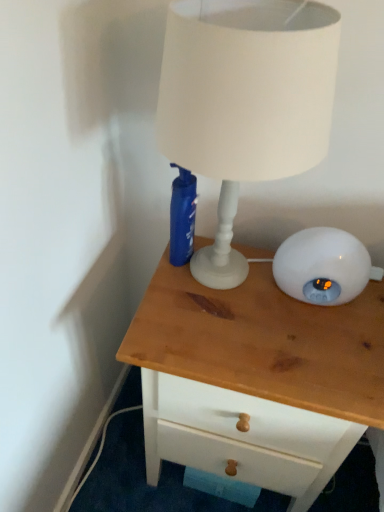
Locate an element on the screen. free location in front of white matte lampshade at upper center is located at coordinates (235, 354).